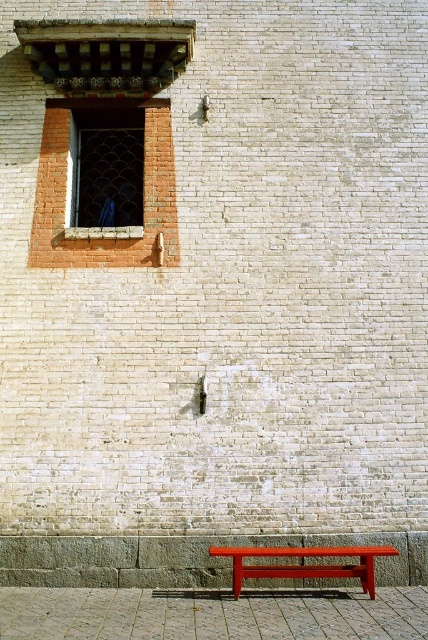
Question: Among these objects, which one is farthest from the camera?

Choices:
 (A) matte red bench at lower center
 (B) matte glass window at upper left

Answer: (B)

Question: Is matte glass window at upper left bigger than matte red bench at lower center?

Choices:
 (A) no
 (B) yes

Answer: (A)

Question: Is matte glass window at upper left closer to camera compared to matte red bench at lower center?

Choices:
 (A) no
 (B) yes

Answer: (A)

Question: Does matte glass window at upper left have a lesser width compared to matte red bench at lower center?

Choices:
 (A) no
 (B) yes

Answer: (B)